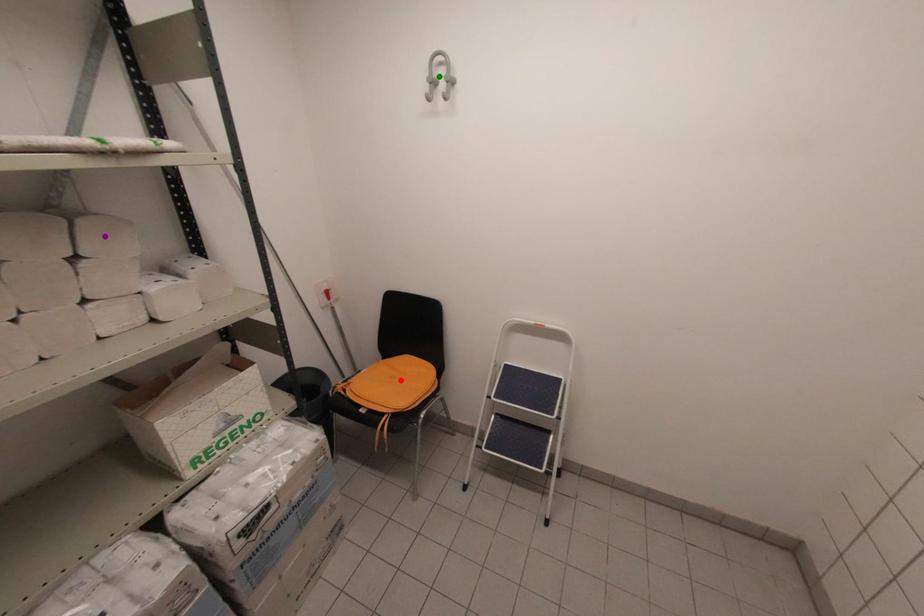
Order these from farthest to nearest:
purple point
red point
green point

red point
green point
purple point